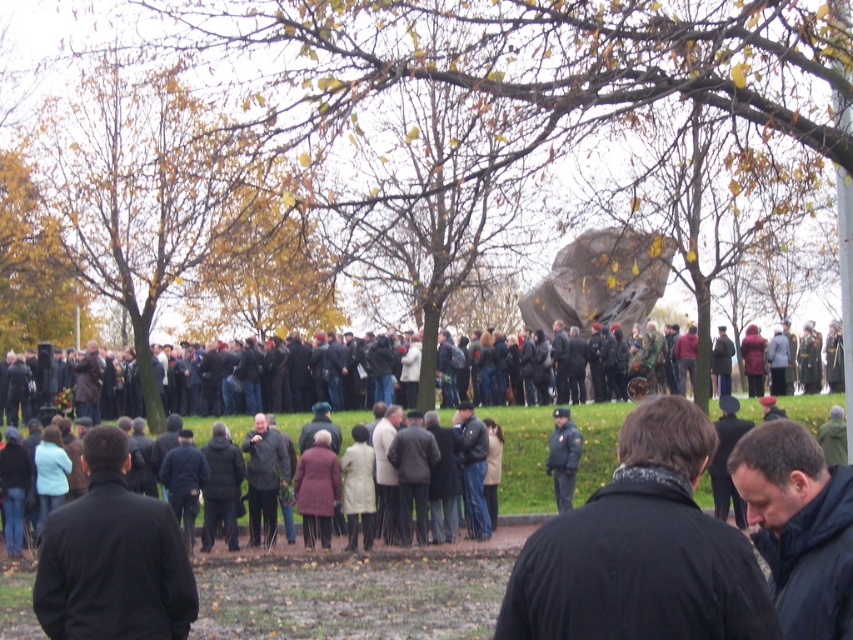
Question: Does brown leafy tree at center appear under black matte jacket at lower right?

Choices:
 (A) yes
 (B) no

Answer: (B)

Question: Considering the relative positions of yellow-green foliage at left and dark brown coat at center in the image provided, where is yellow-green foliage at left located with respect to dark brown coat at center?

Choices:
 (A) right
 (B) left

Answer: (B)

Question: Which object is closer to the camera taking this photo?

Choices:
 (A) black matte jacket at center
 (B) rustic stone monument at center
 (C) black matte jacket at lower right
 (D) black matte jacket at lower left

Answer: (A)

Question: Can you confirm if brown leafy tree at center is positioned to the right of black matte jacket at lower left?

Choices:
 (A) no
 (B) yes

Answer: (B)

Question: Which point is farther to the camera?

Choices:
 (A) (548, 45)
 (B) (80, 81)
 (C) (657, 296)

Answer: (B)

Question: Estimate the real-world distances between objects in this image. Which object is farther from the dark brown coat at center?

Choices:
 (A) brown leafy tree at center
 (B) dark blue uniform at center
 (C) yellow-green foliage at left
 (D) black matte jacket at lower left

Answer: (D)